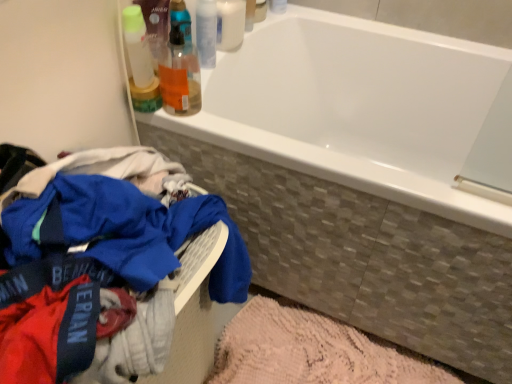
Locate an element on the screen. This screenshot has width=512, height=384. free space to the right of translucent plastic bottles at upper left, which is the first toiletry from bottom to top is located at coordinates (242, 132).